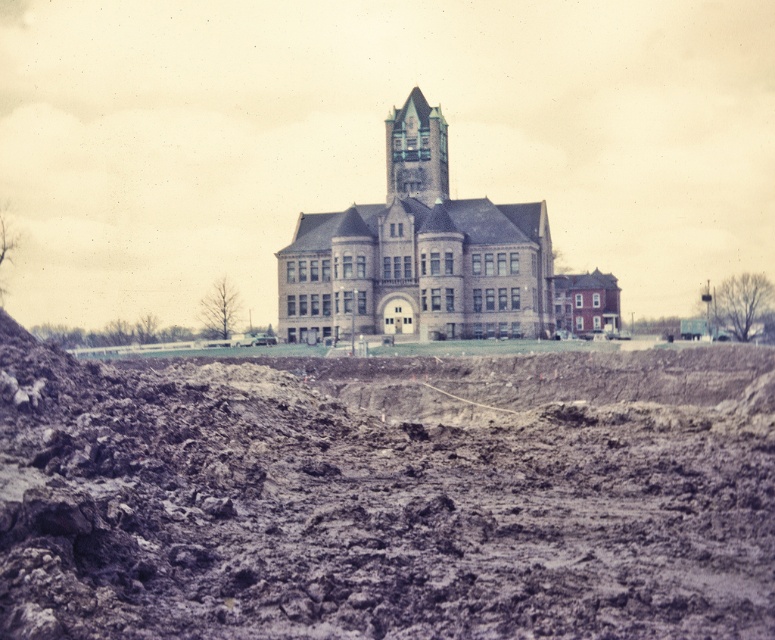
You are a construction worker standing at the base of the blue glass tower at center. You need to transport materials to the clayey brown dirt at center, which is 61.68 meters away. Your truck can carry a maximum load of 10 tons. If each trip takes 15 minutes and you have 3 hours available, how many trips can you make, and what is the total weight you can transport?

You can make 12 trips in 3 hours, and the total weight you can transport is 120 tons.

Consider the image. You are an architect examining the construction site of a brown stone church at center. You notice a mound of clayey brown dirt at center nearby. Based on the elevation differences, which structure is higher?

The brown stone church at center is taller than the clayey brown dirt at center, so the church is higher.

You are a construction worker who needs to transport materials from the clayey brown dirt at center to the brown stone church at center. Given that your equipment can only handle distances up to 150 feet, can you safely move the materials without needing additional support?

The distance between the clayey brown dirt at center and the brown stone church at center is 169.25 feet, which exceeds the equipment capacity of 150 feet. Therefore, additional support or alternative equipment would be required to safely transport the materials over this distance.